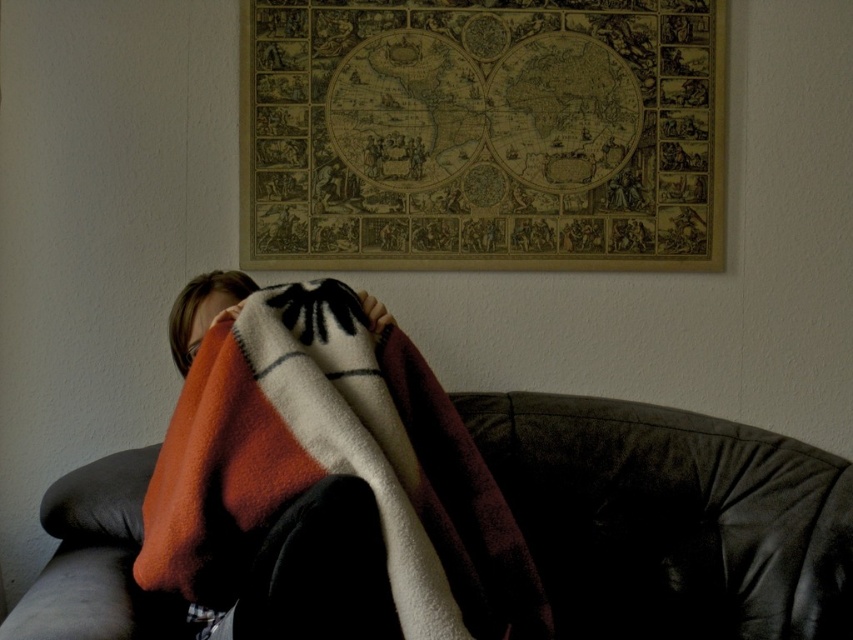
Is multicolored fleece blanket at center taller than smooth skin face at center?

Yes.

Consider the image. Does multicolored fleece blanket at center have a lesser height compared to smooth skin face at center?

No.

Does point (296, 349) come behind point (196, 342)?

No, (296, 349) is closer to viewer.

Where is `multicolored fleece blanket at center`? This screenshot has width=853, height=640. multicolored fleece blanket at center is located at coordinates (334, 467).

At what (x,y) coordinates should I click in order to perform the action: click on leather couch at center. Please return your answer as a coordinate pair (x, y). Looking at the image, I should click on (671, 518).

Is leather couch at center below multicolored fleece blanket at center?

Indeed, leather couch at center is positioned under multicolored fleece blanket at center.

I want to click on leather couch at center, so click(x=671, y=518).

Is leather couch at center further to camera compared to smooth skin face at center?

That is True.

Which of these two, leather couch at center or smooth skin face at center, stands taller?

With more height is leather couch at center.

Where is `leather couch at center`? leather couch at center is located at coordinates 671,518.